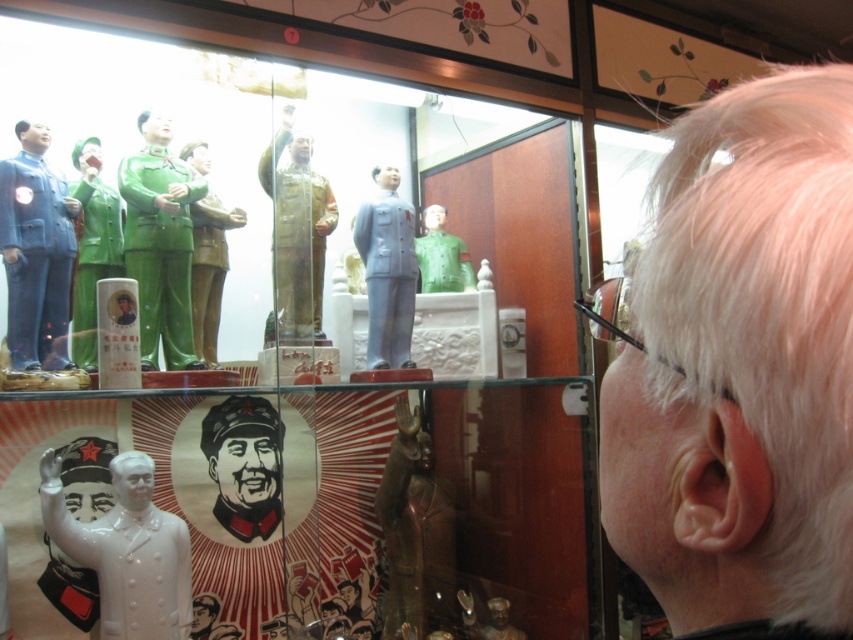
Question: Which of the following is the closest to the observer?

Choices:
 (A) matte plastic figurines at center
 (B) black paper portrait at center
 (C) matte green statue at center
 (D) matte green plastic figurine at center

Answer: (A)

Question: Is green glossy statue at upper left bigger than matte green statue at center?

Choices:
 (A) yes
 (B) no

Answer: (A)

Question: Which object is the closest to the matte blue statue at left?

Choices:
 (A) metallic gold statue at center
 (B) matte green plastic figurine at center
 (C) green glossy statue at upper left
 (D) matte green statue at center

Answer: (C)

Question: Can you confirm if matte plastic figurines at center is smaller than matte green plastic figurine at center?

Choices:
 (A) no
 (B) yes

Answer: (A)

Question: Considering the real-world distances, which object is closest to the black paper portrait at center?

Choices:
 (A) matte green plastic figurine at center
 (B) matte plastic figurines at center
 (C) matte green statue at center

Answer: (A)

Question: Observing the image, what is the correct spatial positioning of black paper portrait at center in reference to matte green statue at center?

Choices:
 (A) above
 (B) below

Answer: (B)